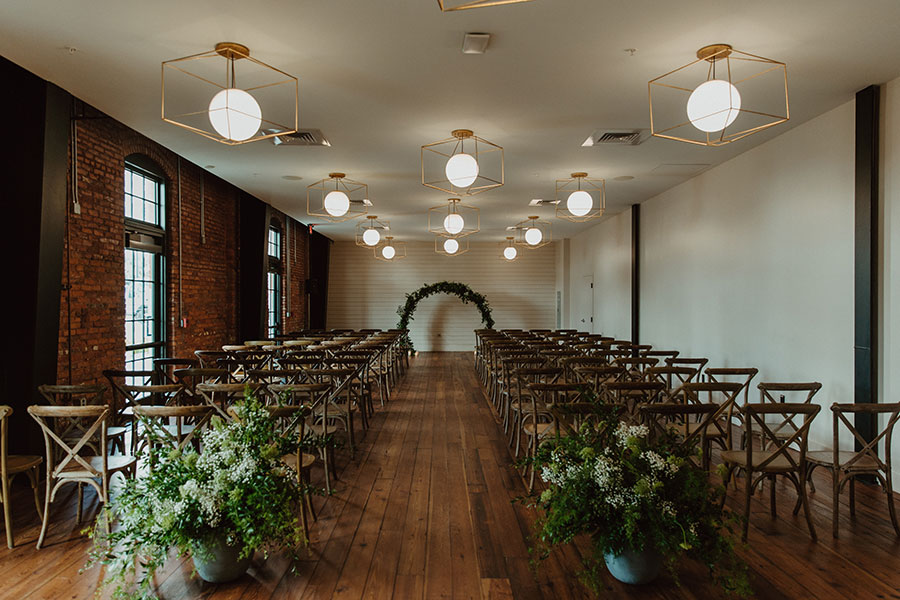
The width and height of the screenshot is (900, 600). In order to click on paneled wall in this screenshot , I will do `click(518, 294)`.